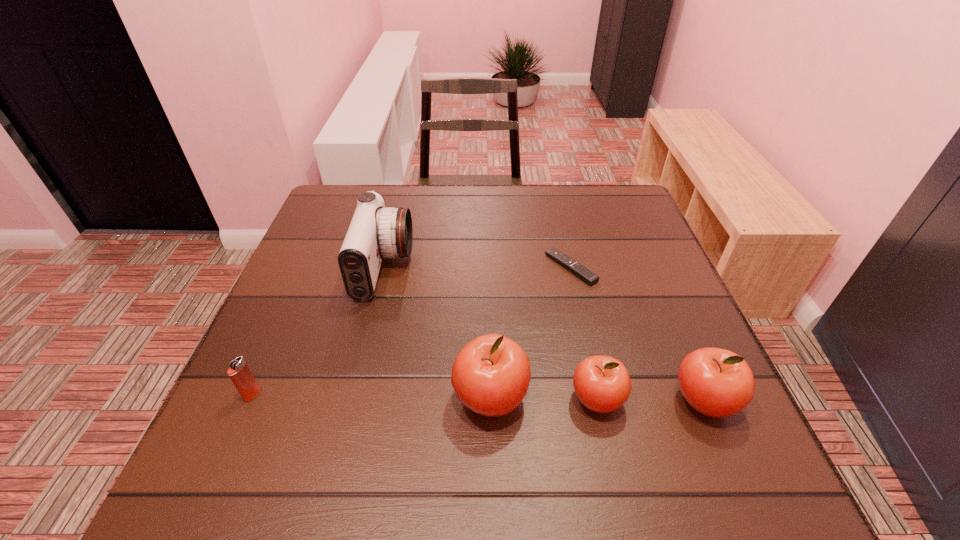
Identify the location of free space between the leftmost object and the camcorder. Image resolution: width=960 pixels, height=540 pixels. (319, 332).

The image size is (960, 540). Find the location of `free space between the leftmost apple and the shortest apple`. free space between the leftmost apple and the shortest apple is located at coordinates click(543, 399).

At what (x,y) coordinates should I click in order to perform the action: click on free area in between the rightmost apple and the second object from left to right. Please return your answer as a coordinate pair (x, y). Looking at the image, I should click on (543, 334).

Image resolution: width=960 pixels, height=540 pixels. Find the location of `the fourth closest object to the second object from left to right`. the fourth closest object to the second object from left to right is located at coordinates (602, 384).

Where is `the fifth closest object relative to the leftmost apple`? the fifth closest object relative to the leftmost apple is located at coordinates (239, 372).

You are a GUI agent. You are given a task and a screenshot of the screen. Output one action in this format:
    pyautogui.click(x=<x>, y=<y>)
    Task: Click on the apple that can be found as the second closest to the fourth tallest object
    This screenshot has width=960, height=540.
    Given the screenshot: What is the action you would take?
    pyautogui.click(x=716, y=382)

Find the location of a particular element. The width and height of the screenshot is (960, 540). apple that is the closest one to the camcorder is located at coordinates (491, 374).

Image resolution: width=960 pixels, height=540 pixels. I want to click on vacant space that satisfies the following two spatial constraints: 1. on the surface of the camcorder; 2. on the back side of the second apple from right to left, so click(352, 399).

The width and height of the screenshot is (960, 540). What are the coordinates of `free location that satisfies the following two spatial constraints: 1. on the surface of the second object from left to right; 2. on the back side of the rightmost apple` in the screenshot? It's located at (352, 401).

Where is `free point that satisfies the following two spatial constraints: 1. on the front side of the rightmost object; 2. on the right side of the third shortest object`? This screenshot has height=540, width=960. free point that satisfies the following two spatial constraints: 1. on the front side of the rightmost object; 2. on the right side of the third shortest object is located at coordinates (597, 401).